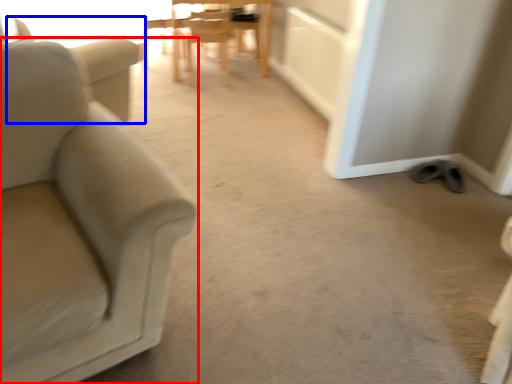
Question: Which object is closer to the camera taking this photo, chair (highlighted by a red box) or swivel chair (highlighted by a blue box)?

Choices:
 (A) chair
 (B) swivel chair

Answer: (A)